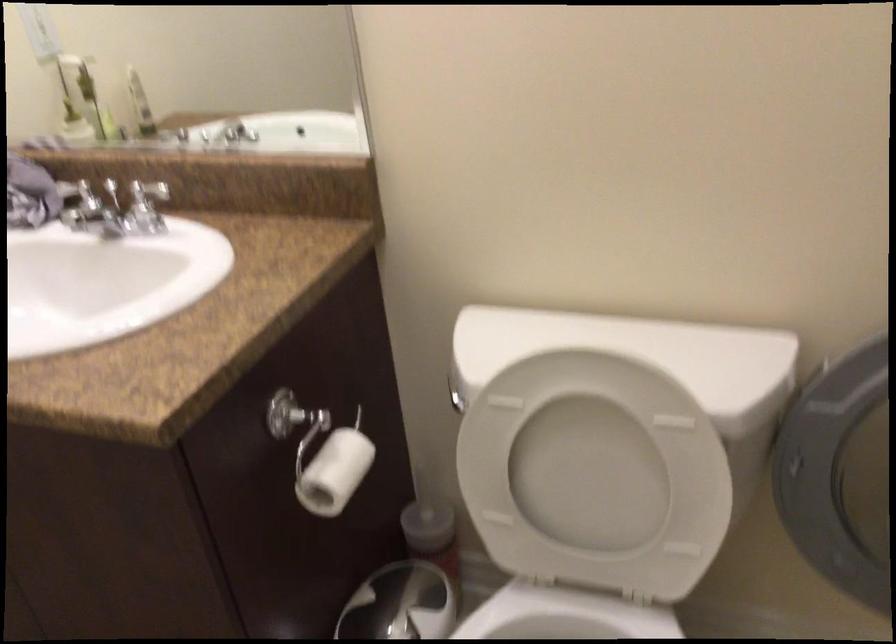
Where is `white toilet lid`? white toilet lid is located at coordinates (595, 475).